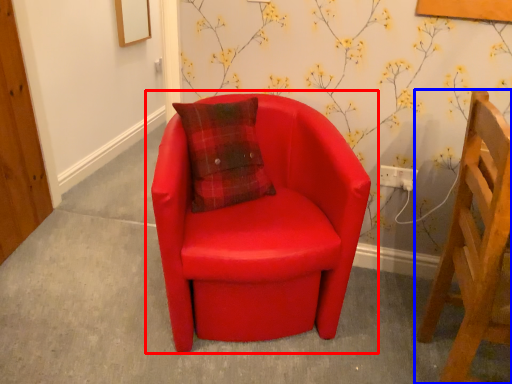
Question: Which object is further to the camera taking this photo, chair (highlighted by a red box) or chair (highlighted by a blue box)?

Choices:
 (A) chair
 (B) chair

Answer: (A)